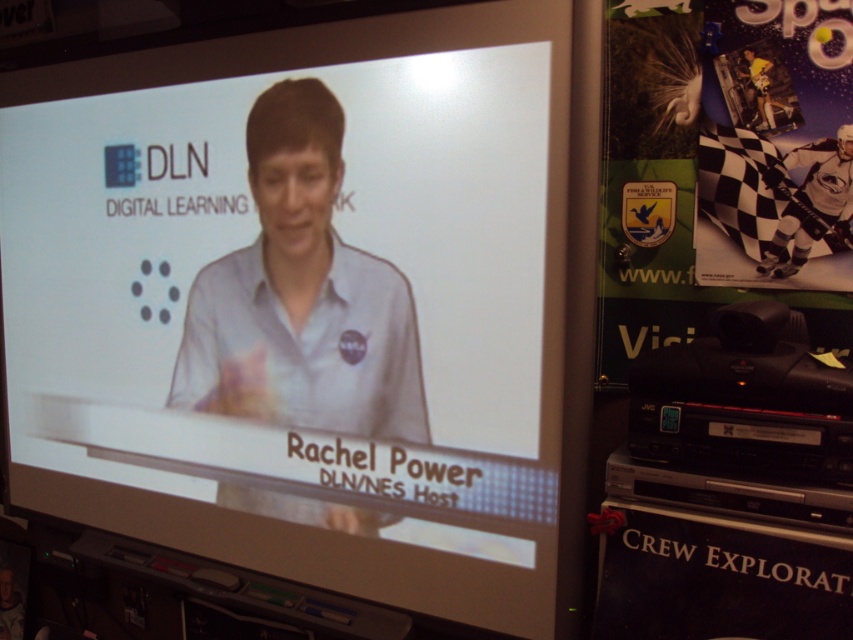
Question: Which of these objects is positioned farthest from the green matte poster at right?

Choices:
 (A) white glossy screen at center
 (B) matte blue shirt at center

Answer: (B)

Question: Which point appears closest to the camera in this image?

Choices:
 (A) (291, 348)
 (B) (386, 83)
 (C) (619, 216)

Answer: (B)

Question: Can you confirm if green matte poster at right is bigger than matte blue shirt at center?

Choices:
 (A) yes
 (B) no

Answer: (B)

Question: Which of the following is the farthest from the observer?

Choices:
 (A) matte blue shirt at center
 (B) green matte poster at right

Answer: (A)

Question: Does green matte poster at right have a larger size compared to matte blue shirt at center?

Choices:
 (A) yes
 (B) no

Answer: (B)

Question: Can you confirm if white glossy screen at center is wider than green matte poster at right?

Choices:
 (A) no
 (B) yes

Answer: (B)